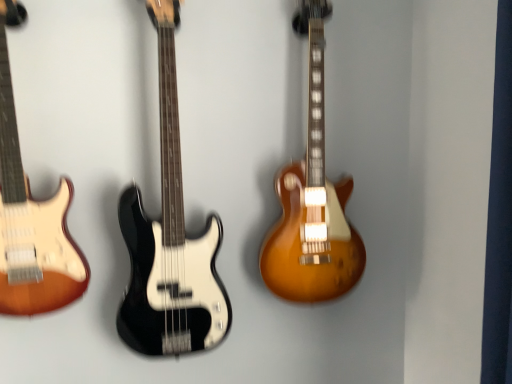
Question: Is point (328, 235) positioned closer to the camera than point (179, 165)?

Choices:
 (A) closer
 (B) farther

Answer: (B)

Question: From the image's perspective, is satin sunburst electric guitar at center, which ranks as the 1th guitar in right-to-left order, positioned above or below black glossy bass guitar at center, which is the second guitar in left-to-right order?

Choices:
 (A) above
 (B) below

Answer: (A)

Question: Which object is the farthest from the black glossy bass guitar at center, positioned as the 2th guitar in right-to-left order?

Choices:
 (A) sunburst wood electric guitar at left, acting as the 3th guitar starting from the right
 (B) satin sunburst electric guitar at center, which ranks as the 1th guitar in right-to-left order

Answer: (B)

Question: Based on their relative distances, which object is farther from the satin sunburst electric guitar at center, which ranks as the 1th guitar in right-to-left order?

Choices:
 (A) black glossy bass guitar at center, positioned as the 2th guitar in right-to-left order
 (B) sunburst wood electric guitar at left, acting as the 3th guitar starting from the right

Answer: (B)